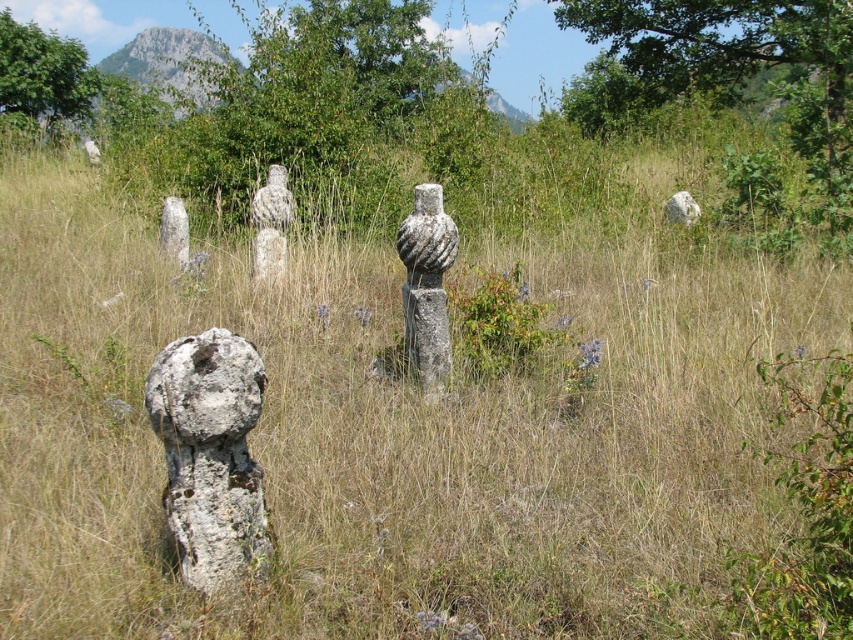
Locate an element on the screen. The height and width of the screenshot is (640, 853). rusty stone statue at center is located at coordinates (204, 388).

Who is more distant from viewer, (166,385) or (256,269)?

The point (256,269) is more distant.

Locate an element on the screen. This screenshot has height=640, width=853. rusty stone statue at center is located at coordinates (204, 388).

Looking at this image, does white stone statue at center have a larger size compared to white rough stone at upper right?

Correct, white stone statue at center is larger in size than white rough stone at upper right.

From the picture: Is white stone statue at center thinner than white rough stone at upper right?

Yes, white stone statue at center is thinner than white rough stone at upper right.

Is point (280, 182) positioned behind point (698, 209)?

No, it is not.

Where is `white stone statue at center`? The width and height of the screenshot is (853, 640). white stone statue at center is located at coordinates coord(273,202).

Is rusty stone statue at center to the left of gray rough stone at center from the viewer's perspective?

In fact, rusty stone statue at center is to the right of gray rough stone at center.

Describe the element at coordinates (204, 388) in the screenshot. I see `rusty stone statue at center` at that location.

The height and width of the screenshot is (640, 853). I want to click on rusty stone statue at center, so click(x=204, y=388).